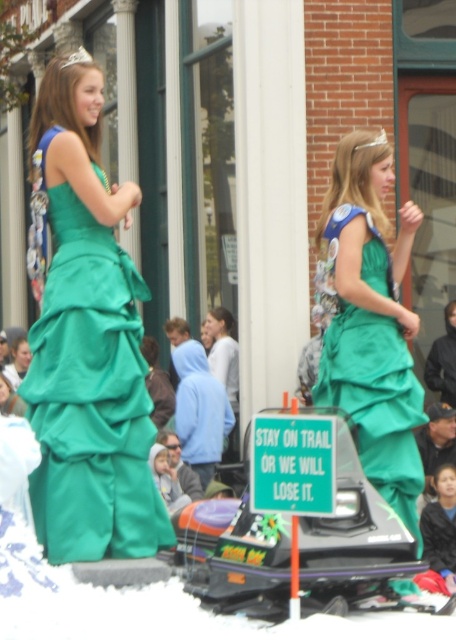
Looking at this image, is emerald satin dress at left positioned before green satin dress at center?

Yes, emerald satin dress at left is in front of green satin dress at center.

Is point (62, 556) less distant than point (324, 392)?

Yes.

Locate an element on the screen. Image resolution: width=456 pixels, height=640 pixels. emerald satin dress at left is located at coordinates (91, 397).